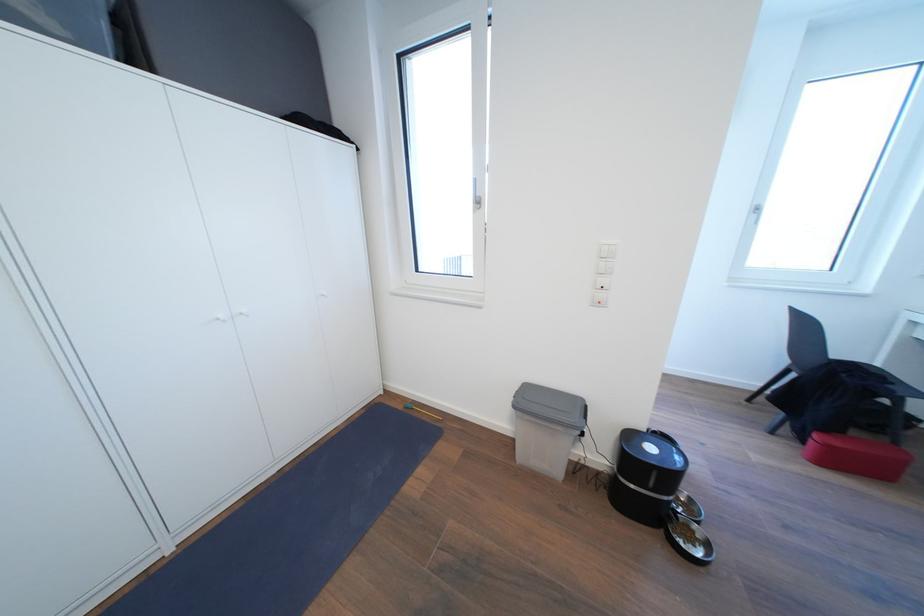
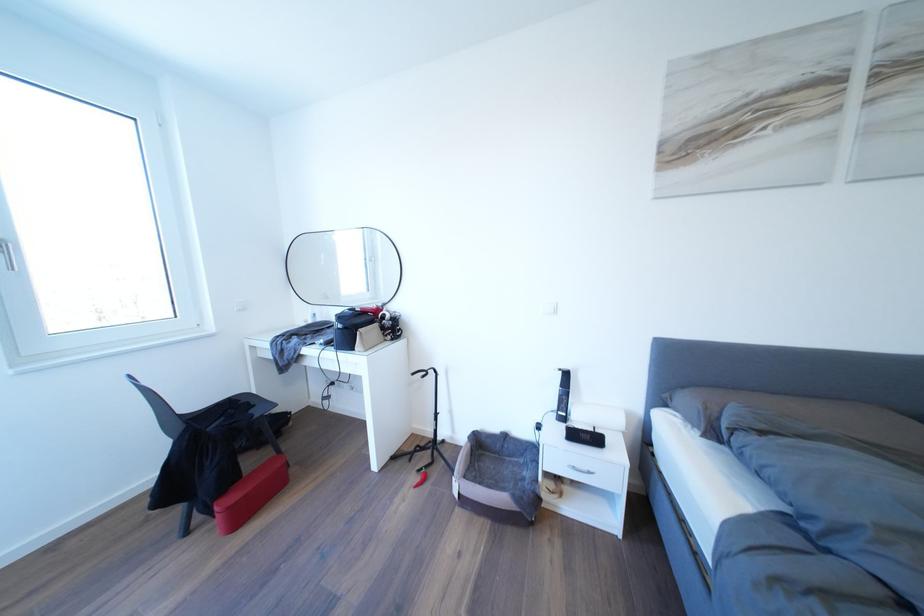
Question: How did the camera likely rotate?

Choices:
 (A) Left
 (B) Right
 (C) Up
 (D) Down

Answer: (B)